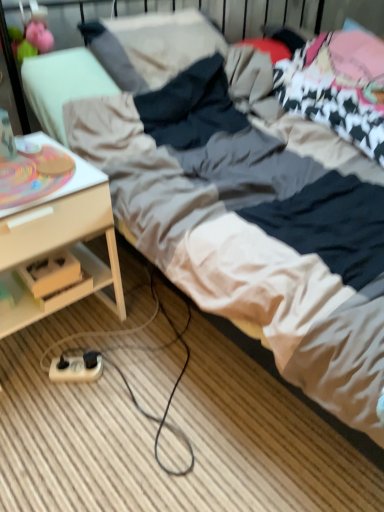
What do you see at coordinates (77, 368) in the screenshot? The image size is (384, 512). I see `beige plastic extension cord at lower left` at bounding box center [77, 368].

Find the location of a particular element. beige plastic extension cord at lower left is located at coordinates (77, 368).

In order to face beige plastic extension cord at lower left, should I rotate leftwards or rightwards?

Turn left by 15.256 degrees to look at beige plastic extension cord at lower left.

What do you see at coordinates (53, 230) in the screenshot? The height and width of the screenshot is (512, 384). I see `white wood desk at lower left` at bounding box center [53, 230].

The height and width of the screenshot is (512, 384). In order to click on white wood desk at lower left in this screenshot , I will do `click(53, 230)`.

From the picture: Measure the distance between point (38, 254) and camera.

3.64 feet.

Where is `beige plastic extension cord at lower left`? The image size is (384, 512). beige plastic extension cord at lower left is located at coordinates point(77,368).

Does white wood desk at lower left appear on the right side of beige plastic extension cord at lower left?

No, white wood desk at lower left is not to the right of beige plastic extension cord at lower left.

Considering their positions, is white wood desk at lower left located in front of or behind beige plastic extension cord at lower left?

Clearly, white wood desk at lower left is in front of beige plastic extension cord at lower left.

Does point (4, 166) come closer to viewer compared to point (73, 373)?

That is True.

From the image's perspective, is white wood desk at lower left above beige plastic extension cord at lower left?

Yes, from the image's perspective, white wood desk at lower left is over beige plastic extension cord at lower left.

From a real-world perspective, is white wood desk at lower left above or below beige plastic extension cord at lower left?

In terms of real-world spatial position, white wood desk at lower left is above beige plastic extension cord at lower left.

Between white wood desk at lower left and beige plastic extension cord at lower left, which one has larger width?

white wood desk at lower left.

Is white wood desk at lower left taller or shorter than beige plastic extension cord at lower left?

white wood desk at lower left is taller than beige plastic extension cord at lower left.

Which of these two, white wood desk at lower left or beige plastic extension cord at lower left, is smaller?

beige plastic extension cord at lower left is smaller.

Is white wood desk at lower left located outside beige plastic extension cord at lower left?

That's correct, white wood desk at lower left is outside of beige plastic extension cord at lower left.

Is white wood desk at lower left touching beige plastic extension cord at lower left?

white wood desk at lower left and beige plastic extension cord at lower left are clearly separated.

Based on the photo, is white wood desk at lower left oriented towards beige plastic extension cord at lower left?

Yes, white wood desk at lower left faces towards beige plastic extension cord at lower left.

What's the angular difference between white wood desk at lower left and beige plastic extension cord at lower left's facing directions?

The angle between the facing direction of white wood desk at lower left and the facing direction of beige plastic extension cord at lower left is 39.7 degrees.

How far apart are white wood desk at lower left and beige plastic extension cord at lower left?

The distance of white wood desk at lower left from beige plastic extension cord at lower left is 14.98 inches.

The width and height of the screenshot is (384, 512). What are the coordinates of `extension cord behind the white wood desk at lower left` in the screenshot? It's located at (77, 368).

Is beige plastic extension cord at lower left at the left side of white wood desk at lower left?

In fact, beige plastic extension cord at lower left is to the right of white wood desk at lower left.

Based on the photo, is beige plastic extension cord at lower left positioned before white wood desk at lower left?

No, beige plastic extension cord at lower left is further to the viewer.

Which is more distant, (x=83, y=376) or (x=50, y=197)?

The point (x=83, y=376) is more distant.

From the image's perspective, is beige plastic extension cord at lower left above or below white wood desk at lower left?

beige plastic extension cord at lower left is below white wood desk at lower left.

From a real-world perspective, which is physically above, beige plastic extension cord at lower left or white wood desk at lower left?

white wood desk at lower left is physically above.

In the scene shown: Considering the sizes of beige plastic extension cord at lower left and white wood desk at lower left in the image, is beige plastic extension cord at lower left wider or thinner than white wood desk at lower left?

beige plastic extension cord at lower left is thinner than white wood desk at lower left.

Considering the sizes of beige plastic extension cord at lower left and white wood desk at lower left in the image, is beige plastic extension cord at lower left taller or shorter than white wood desk at lower left?

Considering their sizes, beige plastic extension cord at lower left has less height than white wood desk at lower left.

Which of these two, beige plastic extension cord at lower left or white wood desk at lower left, is bigger?

white wood desk at lower left.

In the scene shown: Is white wood desk at lower left located within beige plastic extension cord at lower left?

No, white wood desk at lower left is not a part of beige plastic extension cord at lower left.

Is beige plastic extension cord at lower left far from white wood desk at lower left?

beige plastic extension cord at lower left is actually quite close to white wood desk at lower left.

Is beige plastic extension cord at lower left positioned with its back to white wood desk at lower left?

Yes, white wood desk at lower left is at the back of beige plastic extension cord at lower left.

Measure the distance from beige plastic extension cord at lower left to white wood desk at lower left.

A distance of 14.98 inches exists between beige plastic extension cord at lower left and white wood desk at lower left.

The width and height of the screenshot is (384, 512). In order to click on extension cord that is behind the white wood desk at lower left in this screenshot , I will do `click(77, 368)`.

Find the location of `extension cord on the right of white wood desk at lower left`. extension cord on the right of white wood desk at lower left is located at coordinates (77, 368).

Locate an element on the screen. desk above the beige plastic extension cord at lower left (from the image's perspective) is located at coordinates (53, 230).